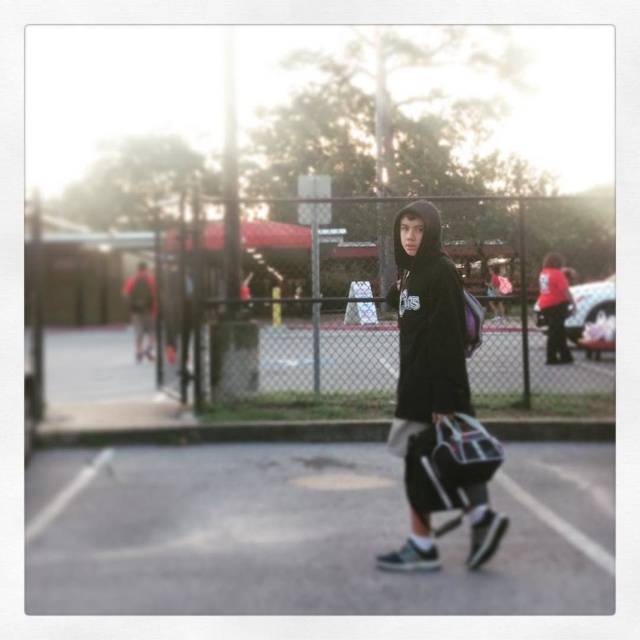
Who is lower down, black fleece hoodie at center or black fleece sweatshirt at center?

black fleece hoodie at center is lower down.

In the scene shown: Between black fleece hoodie at center and black fleece sweatshirt at center, which one has less height?

Standing shorter between the two is black fleece sweatshirt at center.

Which is in front, point (480, 477) or point (420, 307)?

Positioned in front is point (480, 477).

Where is `black fleece hoodie at center`? Image resolution: width=640 pixels, height=640 pixels. black fleece hoodie at center is located at coordinates (436, 397).

Is black fleece hoodie at center shorter than matte black hoodie at center?

Yes.

Between point (404, 332) and point (134, 360), which one is positioned behind?

The point (134, 360) is behind.

The width and height of the screenshot is (640, 640). Find the location of `black fleece hoodie at center`. black fleece hoodie at center is located at coordinates (436, 397).

Can you confirm if black fleece sweatshirt at center is bigger than matte black hoodie at center?

Incorrect, black fleece sweatshirt at center is not larger than matte black hoodie at center.

Find the location of a particular element. Image resolution: width=640 pixels, height=640 pixels. black fleece sweatshirt at center is located at coordinates (428, 323).

Identify the location of black fleece sweatshirt at center. The height and width of the screenshot is (640, 640). (428, 323).